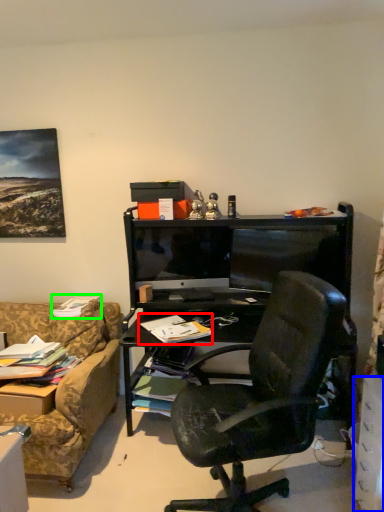
Question: Which object is the farthest from book (highlighted by a red box)? Choose among these: drawer (highlighted by a blue box) or book (highlighted by a green box).

Choices:
 (A) drawer
 (B) book

Answer: (A)